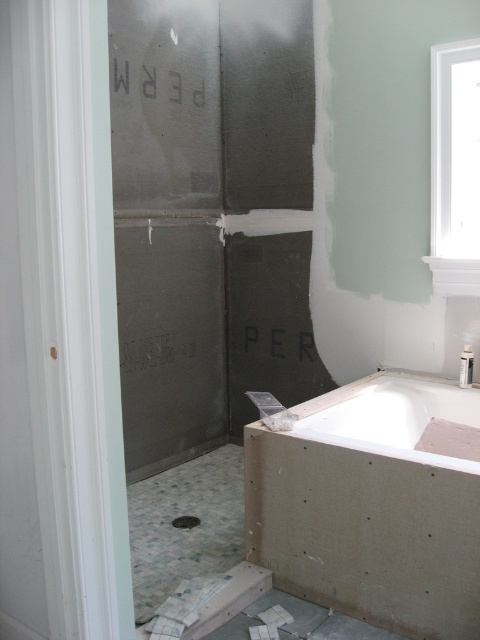
Question: Is white matte bathtub at lower right further to the viewer compared to white glossy bathtub at center?

Choices:
 (A) yes
 (B) no

Answer: (B)

Question: Which point is closer to the camera?

Choices:
 (A) white matte bathtub at lower right
 (B) white glossy bathtub at center

Answer: (A)

Question: Which object is farther from the camera taking this photo?

Choices:
 (A) white matte bathtub at lower right
 (B) white glossy bathtub at center

Answer: (B)

Question: Is white matte bathtub at lower right smaller than white glossy bathtub at center?

Choices:
 (A) yes
 (B) no

Answer: (B)

Question: Does white matte bathtub at lower right lie in front of white glossy bathtub at center?

Choices:
 (A) no
 (B) yes

Answer: (B)